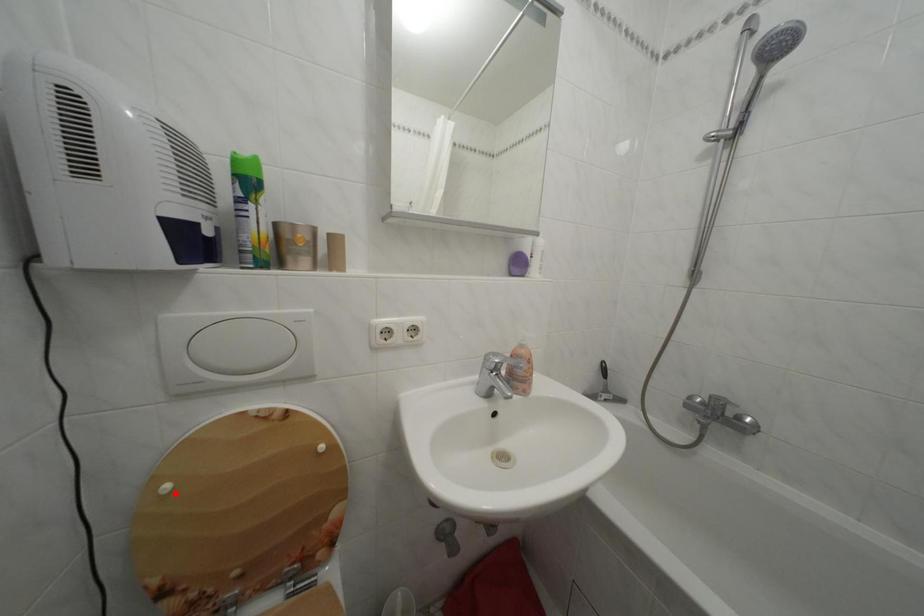
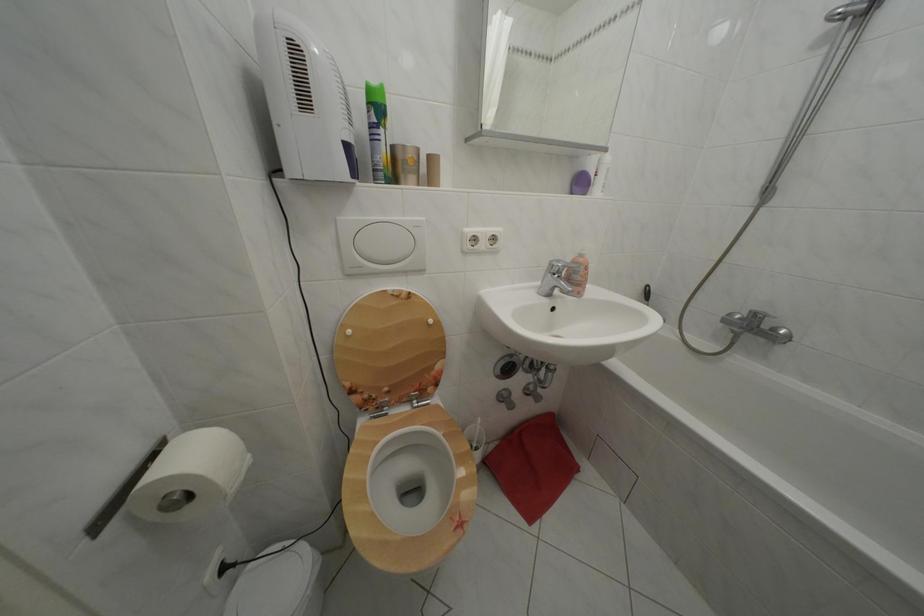
Find the pixel in the second image that matches the highlighted location in the first image.

(358, 338)